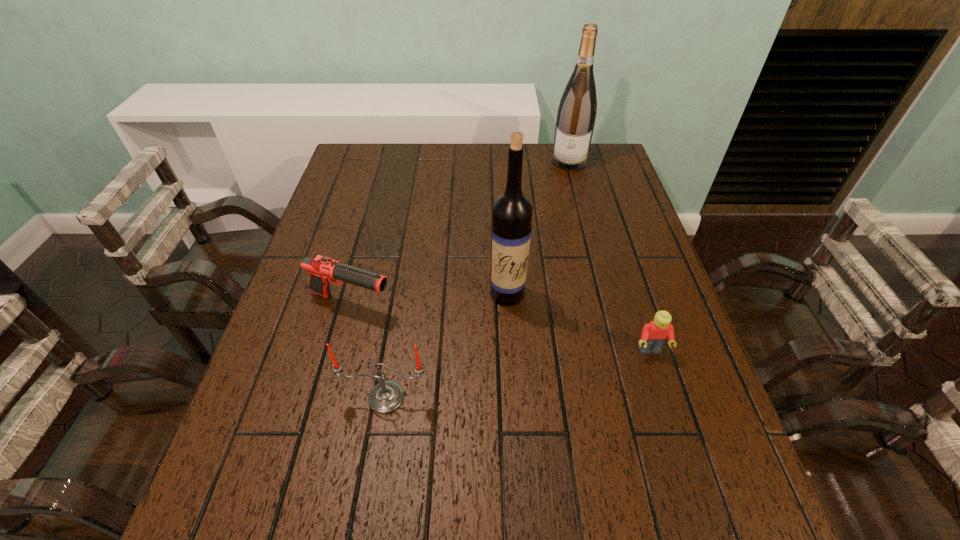
The width and height of the screenshot is (960, 540). I want to click on object that is at the left edge, so click(x=322, y=270).

The image size is (960, 540). I want to click on Lego that is positioned at the right edge, so click(x=654, y=335).

This screenshot has width=960, height=540. In order to click on wine bottle that is at the right edge in this screenshot , I will do `click(576, 115)`.

The image size is (960, 540). Find the location of `object that is at the far right corner`. object that is at the far right corner is located at coordinates (576, 115).

This screenshot has height=540, width=960. Find the location of `blank space at the far edge of the desktop`. blank space at the far edge of the desktop is located at coordinates (547, 163).

This screenshot has width=960, height=540. In order to click on vacant space at the near edge of the desktop in this screenshot , I will do `click(588, 469)`.

Where is `vacant area at the left edge`? The width and height of the screenshot is (960, 540). vacant area at the left edge is located at coordinates (291, 336).

Locate an element on the screen. The width and height of the screenshot is (960, 540). vacant region at the right edge of the desktop is located at coordinates (605, 252).

The image size is (960, 540). In the image, there is a desktop. Find the location of `vacant space at the far left corner`. vacant space at the far left corner is located at coordinates (351, 156).

In order to click on free space at the near left corner of the desktop in this screenshot , I will do `click(318, 448)`.